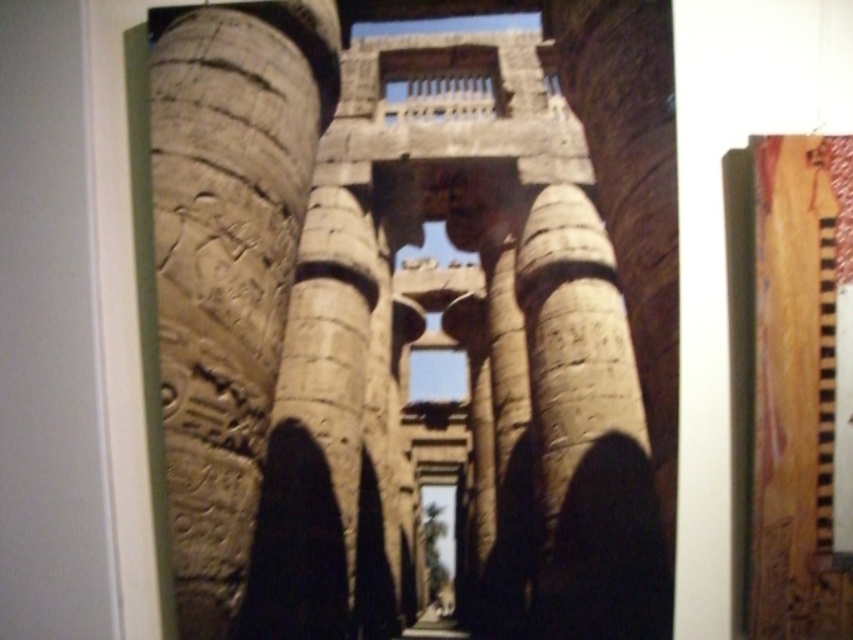
You are an archaeologist examining the temple structure. You notice two carved stone columns at the center of the temple. One is labeled as carved stone columns at center and the other as carved stone column at center. Which one has a greater width?

The carved stone columns at center has a greater width than the carved stone column at center.